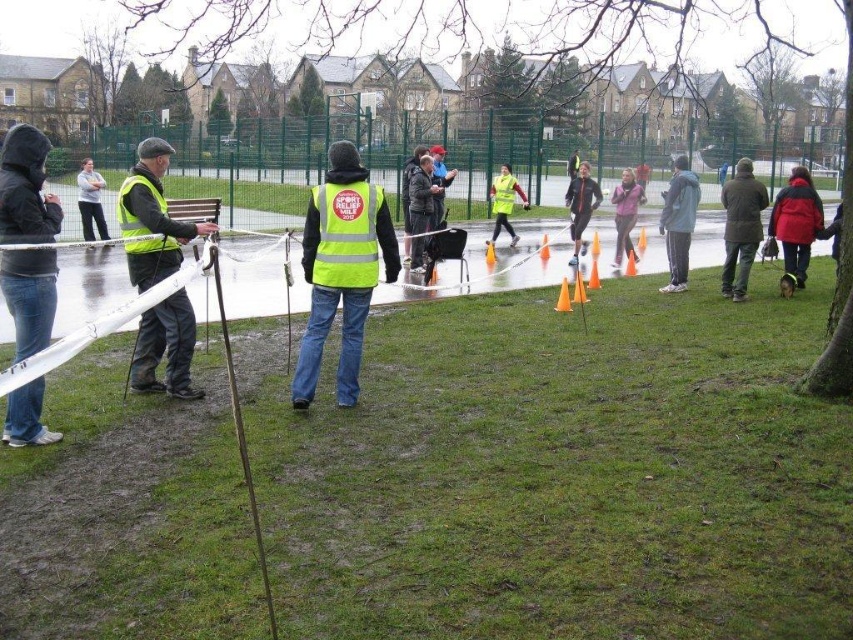
You are a photographer at the event and need to take a clear photo of the neon yellow reflective vest at center. Your camera has a maximum focus range of 6 meters. Can you capture the vest clearly without moving closer?

The neon yellow reflective vest at center and camera are 6.44 meters apart, which exceeds the camera maximum focus range of 6 meters. Therefore, you cannot capture the vest clearly without moving closer.

You are a participant in the charity event and want to approach the person in the neon yellow reflective vest at center to ask for directions. There is also a person wearing a dark gray hooded jacket at left in your way. Which person do you need to move around to reach the one you need?

You need to move around the dark gray hooded jacket at left because the neon yellow reflective vest at center is closer to you, so the dark gray hooded jacket at left is blocking your path.

You are standing at the point labeled as point (x=300, y=346) in the image. You want to walk to the nearest tree located 10 feet away from your current position. Is there enough space between you and the nearest tree to walk comfortably?

The distance between you and the nearest tree is 10 feet, which is less than the 21.89 feet between you and the viewer. Therefore, there is enough space to walk comfortably to the tree.